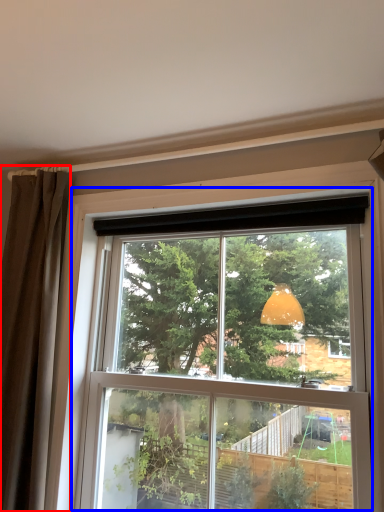
Question: Which of the following is the farthest to the observer, curtain (highlighted by a red box) or window (highlighted by a blue box)?

Choices:
 (A) curtain
 (B) window

Answer: (A)